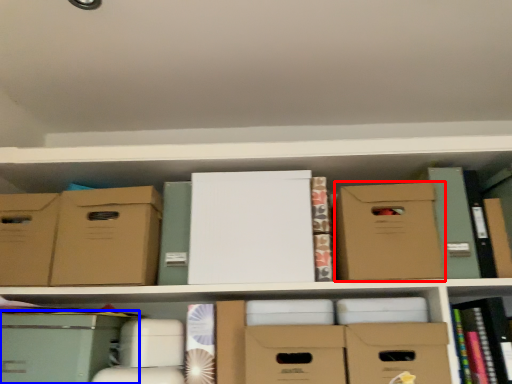
Question: Which object is closer to the camera taking this photo, cardboard box (highlighted by a red box) or storage box (highlighted by a blue box)?

Choices:
 (A) cardboard box
 (B) storage box

Answer: (B)